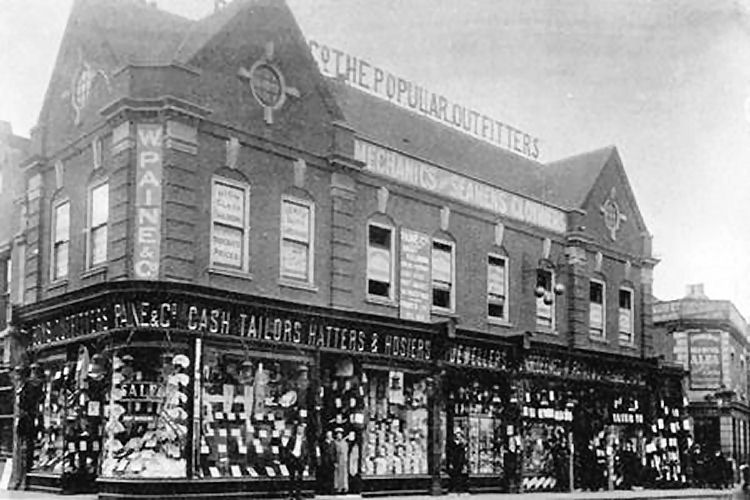
I want to click on window, so 385,277.